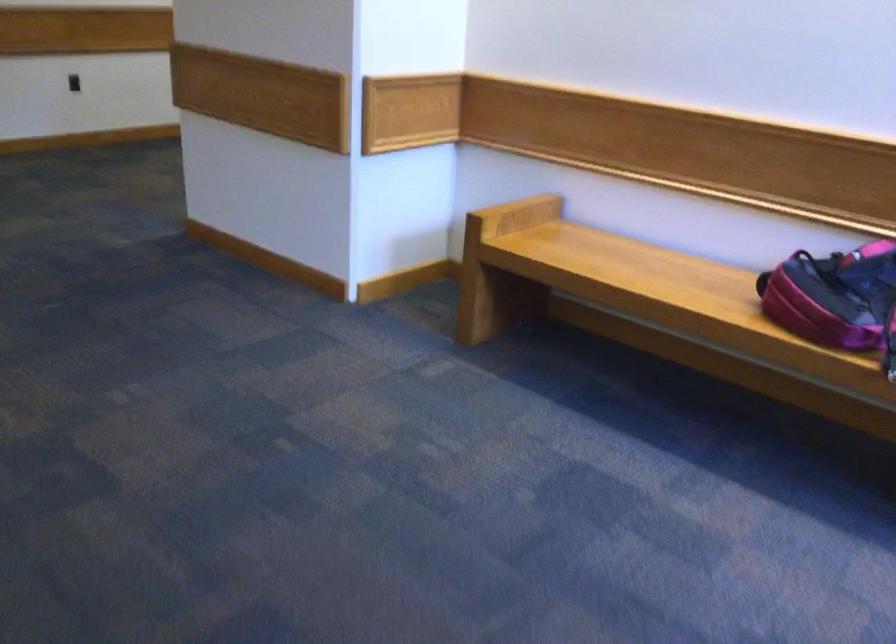
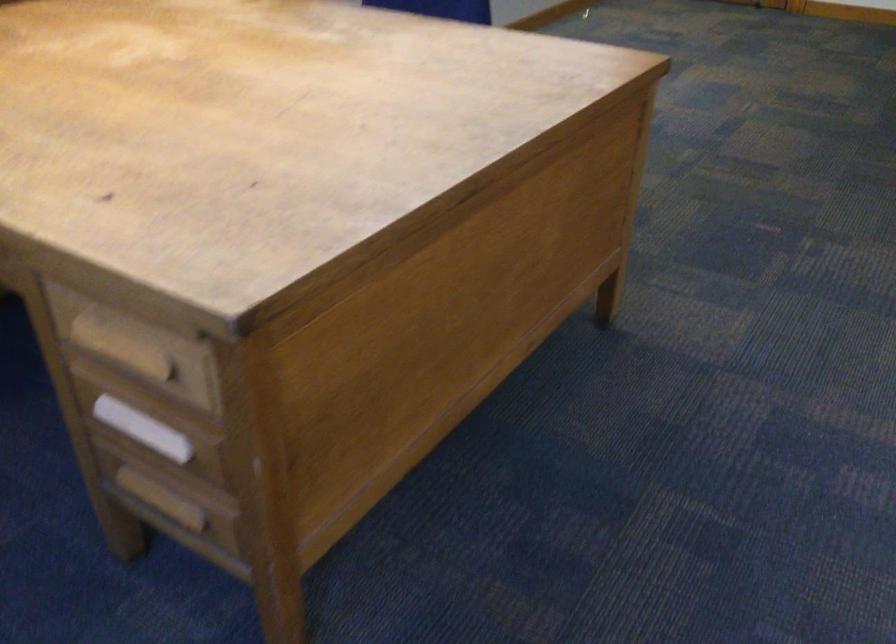
Based on the continuous images, in which direction is the camera rotating?

The camera rotated toward left-down.